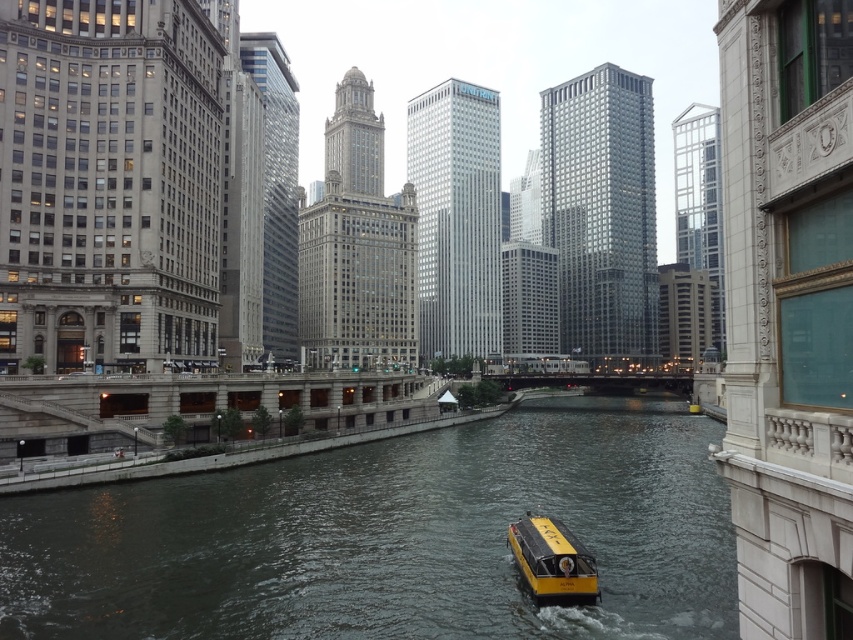
You are a drone operator trying to capture aerial footage of the urban river scene. Your drone is currently hovering above the dark gray water at center and the yellow matte boat at center. To ensure safety, you need to know which object is higher from the ground. Can you determine which one is taller?

The dark gray water at center is taller than the yellow matte boat at center, so the water is higher from the ground than the boat.

You are a tourist standing on a bridge overlooking the river. You see the dark gray water at center and the yellow matte boat at center. Which object is positioned lower from your viewpoint?

The dark gray water at center is located below the yellow matte boat at center, so it is positioned lower from your viewpoint.